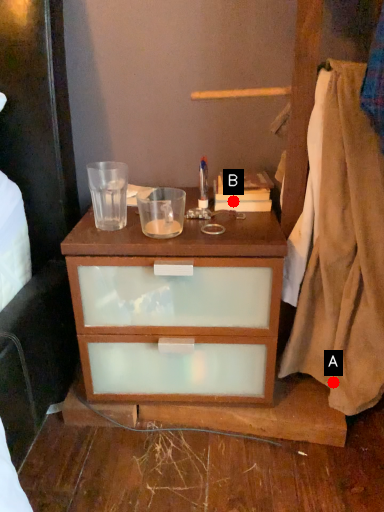
Question: Two points are circled on the image, labeled by A and B beside each circle. Which of the following is the farthest from the observer?

Choices:
 (A) A is further
 (B) B is further

Answer: (B)